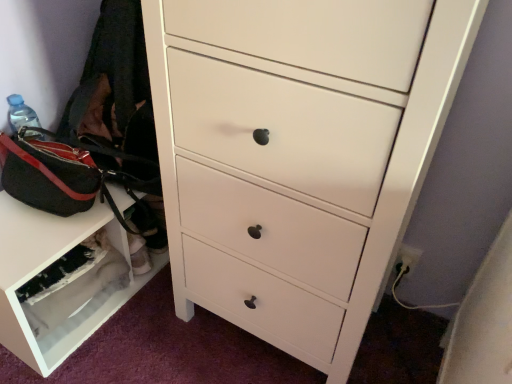
Where is `white matte shoe rack at lower left`? The width and height of the screenshot is (512, 384). white matte shoe rack at lower left is located at coordinates (64, 287).

Locate an element on the screen. The height and width of the screenshot is (384, 512). white glossy chest of drawers at center is located at coordinates (297, 154).

Consider the image. Does white matte shoe rack at lower left appear on the right side of black canvas messenger bag at left?

No.

The image size is (512, 384). Find the location of `cabinetry below the black canvas messenger bag at left (from the image's perspective)`. cabinetry below the black canvas messenger bag at left (from the image's perspective) is located at coordinates (64, 287).

From a real-world perspective, relative to black canvas messenger bag at left, is white matte shoe rack at lower left vertically above or below?

white matte shoe rack at lower left is below black canvas messenger bag at left.

Is white matte shoe rack at lower left turned away from black canvas messenger bag at left?

white matte shoe rack at lower left is not turned away from black canvas messenger bag at left.

Considering the positions of objects black canvas messenger bag at left and white matte shoe rack at lower left in the image provided, who is behind, black canvas messenger bag at left or white matte shoe rack at lower left?

white matte shoe rack at lower left is further from the camera.

How different are the orientations of black canvas messenger bag at left and white matte shoe rack at lower left in degrees?

1.15 degrees separate the facing orientations of black canvas messenger bag at left and white matte shoe rack at lower left.

Between black canvas messenger bag at left and white matte shoe rack at lower left, which one has smaller width?

white matte shoe rack at lower left.

Is black canvas messenger bag at left to the left of white matte shoe rack at lower left from the viewer's perspective?

In fact, black canvas messenger bag at left is to the right of white matte shoe rack at lower left.

Between white matte shoe rack at lower left and white glossy chest of drawers at center, which one has smaller size?

white matte shoe rack at lower left is smaller.

Is white matte shoe rack at lower left positioned with its back to white glossy chest of drawers at center?

No, white matte shoe rack at lower left's orientation is not away from white glossy chest of drawers at center.

This screenshot has height=384, width=512. Find the location of `chest of drawers in front of the white matte shoe rack at lower left`. chest of drawers in front of the white matte shoe rack at lower left is located at coordinates (297, 154).

From the picture: Which object is positioned more to the left, white matte shoe rack at lower left or white glossy chest of drawers at center?

white matte shoe rack at lower left is more to the left.

Is white glossy chest of drawers at center bigger or smaller than black canvas messenger bag at left?

Considering their sizes, white glossy chest of drawers at center takes up more space than black canvas messenger bag at left.

Which object is further away from the camera taking this photo, white glossy chest of drawers at center or black canvas messenger bag at left?

black canvas messenger bag at left is further from the camera.

Considering the positions of objects white glossy chest of drawers at center and black canvas messenger bag at left in the image provided, who is more to the right, white glossy chest of drawers at center or black canvas messenger bag at left?

white glossy chest of drawers at center is more to the right.

What's the angular difference between white glossy chest of drawers at center and black canvas messenger bag at left's facing directions?

91.9 degrees separate the facing orientations of white glossy chest of drawers at center and black canvas messenger bag at left.

From a real-world perspective, is black canvas messenger bag at left positioned above or below white glossy chest of drawers at center?

black canvas messenger bag at left is situated lower than white glossy chest of drawers at center in the real world.

Is black canvas messenger bag at left in front of white glossy chest of drawers at center?

No, the depth of black canvas messenger bag at left is greater than that of white glossy chest of drawers at center.

Is point (6, 189) in front of point (224, 50)?

No.

Which of these two, white glossy chest of drawers at center or white matte shoe rack at lower left, is thinner?

white matte shoe rack at lower left.

The image size is (512, 384). Find the location of `cabinetry below the white glossy chest of drawers at center (from the image's perspective)`. cabinetry below the white glossy chest of drawers at center (from the image's perspective) is located at coordinates (64, 287).

Locate an element on the screen. The image size is (512, 384). cabinetry below the black canvas messenger bag at left (from the image's perspective) is located at coordinates (64, 287).

The width and height of the screenshot is (512, 384). Find the location of `messenger bag above the white matte shoe rack at lower left (from a real-world perspective)`. messenger bag above the white matte shoe rack at lower left (from a real-world perspective) is located at coordinates (59, 176).

When comparing their distances from white glossy chest of drawers at center, does white matte shoe rack at lower left or black canvas messenger bag at left seem further?

black canvas messenger bag at left is positioned further to the anchor white glossy chest of drawers at center.

Consider the image. Estimate the real-world distances between objects in this image. Which object is further from white matte shoe rack at lower left, black canvas messenger bag at left or white glossy chest of drawers at center?

Among the two, white glossy chest of drawers at center is located further to white matte shoe rack at lower left.

Looking at the image, which one is located closer to white glossy chest of drawers at center, black canvas messenger bag at left or white matte shoe rack at lower left?

The object closer to white glossy chest of drawers at center is white matte shoe rack at lower left.

Estimate the real-world distances between objects in this image. Which object is further from black canvas messenger bag at left, white matte shoe rack at lower left or white glossy chest of drawers at center?

white glossy chest of drawers at center.

From the image, which object appears to be nearer to black canvas messenger bag at left, white glossy chest of drawers at center or white matte shoe rack at lower left?

white matte shoe rack at lower left is positioned closer to the anchor black canvas messenger bag at left.

Consider the image. When comparing their distances from white matte shoe rack at lower left, does white glossy chest of drawers at center or black canvas messenger bag at left seem further?

Among the two, white glossy chest of drawers at center is located further to white matte shoe rack at lower left.

The image size is (512, 384). What are the coordinates of `messenger bag between white matte shoe rack at lower left and white glossy chest of drawers at center in the horizontal direction` in the screenshot? It's located at (59, 176).